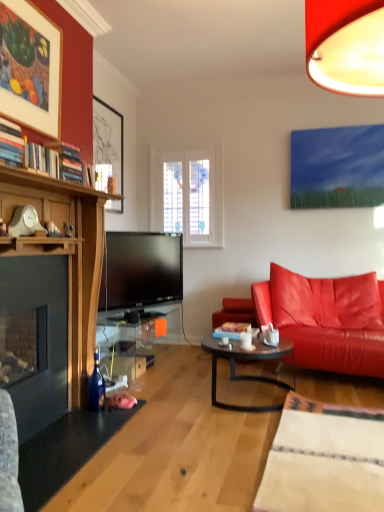
This screenshot has width=384, height=512. Describe the element at coordinates (30, 67) in the screenshot. I see `matte wood picture frame at upper left, the second picture frame positioned from the back` at that location.

What is the approximate height of matte wood picture frame at upper left, the second picture frame positioned from the back?

The height of matte wood picture frame at upper left, the second picture frame positioned from the back, is 27.87 inches.

Where is `leather couch at right`? This screenshot has width=384, height=512. leather couch at right is located at coordinates (326, 319).

Image resolution: width=384 pixels, height=512 pixels. Find the location of `matte wood picture frame at upper left, which is counted as the 1th picture frame, starting from the front`. matte wood picture frame at upper left, which is counted as the 1th picture frame, starting from the front is located at coordinates (30, 67).

Based on the photo, is matte black picture frame at upper left, acting as the 1th picture frame starting from the back, shorter than dark brown glass coffee table at center?

In fact, matte black picture frame at upper left, acting as the 1th picture frame starting from the back, may be taller than dark brown glass coffee table at center.

Is matte black picture frame at upper left, which is the second picture frame from front to back, wider or thinner than dark brown glass coffee table at center?

matte black picture frame at upper left, which is the second picture frame from front to back, is thinner than dark brown glass coffee table at center.

This screenshot has width=384, height=512. In order to click on the 1st picture frame located above the dark brown glass coffee table at center (from a real-world perspective) in this screenshot , I will do `click(108, 140)`.

Is matte black picture frame at upper left, which is the second picture frame from front to back, bigger than dark brown glass coffee table at center?

No, matte black picture frame at upper left, which is the second picture frame from front to back, is not bigger than dark brown glass coffee table at center.

Are transparent glass table at lower center and leather couch at right far apart?

Yes, transparent glass table at lower center and leather couch at right are quite far apart.

How different are the orientations of transparent glass table at lower center and leather couch at right in degrees?

102 degrees.

Is leather couch at right a part of transparent glass table at lower center?

No, leather couch at right is not surrounded by transparent glass table at lower center.

From the image's perspective, which one is positioned higher, matte black picture frame at upper left, which is the second picture frame from front to back, or matte wood picture frame at upper left, which is counted as the 1th picture frame, starting from the front?

From the image's view, matte wood picture frame at upper left, which is counted as the 1th picture frame, starting from the front, is above.

Identify the location of picture frame above the matte black picture frame at upper left, which is the second picture frame from front to back (from a real-world perspective). The width and height of the screenshot is (384, 512). (30, 67).

Is matte black picture frame at upper left, which is the second picture frame from front to back, aimed at matte wood picture frame at upper left, the second picture frame positioned from the back?

No, matte black picture frame at upper left, which is the second picture frame from front to back, is not turned towards matte wood picture frame at upper left, the second picture frame positioned from the back.

Consider the image. Which point is more distant from viewer, (110, 114) or (44, 79)?

The point (110, 114) is farther.

From a real-world perspective, is matte wood picture frame at upper left, which is counted as the 1th picture frame, starting from the front, located higher than dark brown glass coffee table at center?

Yes, from a real-world perspective, matte wood picture frame at upper left, which is counted as the 1th picture frame, starting from the front, is over dark brown glass coffee table at center

Is matte wood picture frame at upper left, the second picture frame positioned from the back, facing towards dark brown glass coffee table at center?

No, matte wood picture frame at upper left, the second picture frame positioned from the back, is not facing towards dark brown glass coffee table at center.

Which object is more forward, matte wood picture frame at upper left, the second picture frame positioned from the back, or dark brown glass coffee table at center?

matte wood picture frame at upper left, the second picture frame positioned from the back, is more forward.

Is matte wood picture frame at upper left, the second picture frame positioned from the back, outside of dark brown glass coffee table at center?

Absolutely, matte wood picture frame at upper left, the second picture frame positioned from the back, is external to dark brown glass coffee table at center.

In the image, is white ceramic mug at center positioned in front of or behind dark brown glass coffee table at center?

In the image, white ceramic mug at center appears behind dark brown glass coffee table at center.

Between white ceramic mug at center and dark brown glass coffee table at center, which one has larger width?

dark brown glass coffee table at center is wider.

Is white ceramic mug at center touching dark brown glass coffee table at center?

No, white ceramic mug at center is not touching dark brown glass coffee table at center.

From a real-world perspective, between white ceramic mug at center and dark brown glass coffee table at center, who is vertically lower?

dark brown glass coffee table at center is physically lower.

Is dark brown glass coffee table at center oriented away from transparent glass table at lower center?

No, transparent glass table at lower center is not at the back of dark brown glass coffee table at center.

Could you measure the distance between dark brown glass coffee table at center and transparent glass table at lower center?

dark brown glass coffee table at center is 1.13 meters away from transparent glass table at lower center.

Is dark brown glass coffee table at center spatially inside transparent glass table at lower center, or outside of it?

dark brown glass coffee table at center is not inside transparent glass table at lower center, it's outside.

From the image's perspective, would you say dark brown glass coffee table at center is positioned over transparent glass table at lower center?

No, from the image's perspective, dark brown glass coffee table at center is not over transparent glass table at lower center.

Could matte black picture frame at upper left, acting as the 1th picture frame starting from the back, be considered to be inside matte wood picture frame at upper left, which is counted as the 1th picture frame, starting from the front?

No, matte black picture frame at upper left, acting as the 1th picture frame starting from the back, is not surrounded by matte wood picture frame at upper left, which is counted as the 1th picture frame, starting from the front.

From a real-world perspective, is matte wood picture frame at upper left, the second picture frame positioned from the back, on top of matte black picture frame at upper left, which is the second picture frame from front to back?

Yes, from a real-world perspective, matte wood picture frame at upper left, the second picture frame positioned from the back, is above matte black picture frame at upper left, which is the second picture frame from front to back.

Between matte wood picture frame at upper left, the second picture frame positioned from the back, and matte black picture frame at upper left, acting as the 1th picture frame starting from the back, which one has smaller size?

Smaller between the two is matte wood picture frame at upper left, the second picture frame positioned from the back.

From the image's perspective, count 1st picture frames upward from the dark brown glass coffee table at center and point to it. Please provide its 2D coordinates.

[(108, 140)]

Where is `table that appears below the leather couch at right (from the image's perspective)`? The width and height of the screenshot is (384, 512). table that appears below the leather couch at right (from the image's perspective) is located at coordinates (135, 340).

Looking at the image, which one is located closer to white ceramic mug at center, leather couch at right or matte black picture frame at upper left, which is the second picture frame from front to back?

leather couch at right lies closer to white ceramic mug at center than the other object.

Based on the photo, which object lies further to the anchor point leather couch at right, transparent glass table at lower center or matte wood picture frame at upper left, the second picture frame positioned from the back?

Among the two, matte wood picture frame at upper left, the second picture frame positioned from the back, is located further to leather couch at right.

In the scene shown: When comparing their distances from matte wood picture frame at upper left, which is counted as the 1th picture frame, starting from the front, does matte black picture frame at upper left, which is the second picture frame from front to back, or white ceramic mug at center seem further?

Based on the image, white ceramic mug at center appears to be further to matte wood picture frame at upper left, which is counted as the 1th picture frame, starting from the front.

Considering their positions, is transparent glass table at lower center positioned closer to matte black picture frame at upper left, which is the second picture frame from front to back, than dark brown glass coffee table at center?

transparent glass table at lower center is positioned closer to the anchor matte black picture frame at upper left, which is the second picture frame from front to back.

Based on their spatial positions, is leather couch at right or matte wood picture frame at upper left, the second picture frame positioned from the back, further from white ceramic mug at center?

matte wood picture frame at upper left, the second picture frame positioned from the back, is further to white ceramic mug at center.

Looking at the image, which one is located closer to matte black picture frame at upper left, acting as the 1th picture frame starting from the back, leather couch at right or white ceramic mug at center?

Among the two, leather couch at right is located nearer to matte black picture frame at upper left, acting as the 1th picture frame starting from the back.

Looking at the image, which one is located further to matte black picture frame at upper left, which is the second picture frame from front to back, white ceramic mug at center or transparent glass table at lower center?

white ceramic mug at center.

Which object lies further to the anchor point white ceramic mug at center, matte black picture frame at upper left, which is the second picture frame from front to back, or dark brown glass coffee table at center?

The object further to white ceramic mug at center is matte black picture frame at upper left, which is the second picture frame from front to back.

Where is `picture frame between matte wood picture frame at upper left, which is counted as the 1th picture frame, starting from the front, and leather couch at right from left to right`? picture frame between matte wood picture frame at upper left, which is counted as the 1th picture frame, starting from the front, and leather couch at right from left to right is located at coordinates (108, 140).

This screenshot has height=512, width=384. I want to click on table between matte black picture frame at upper left, acting as the 1th picture frame starting from the back, and dark brown glass coffee table at center, in the vertical direction, so click(135, 340).

Locate an element on the screen. This screenshot has width=384, height=512. coffee cup between matte wood picture frame at upper left, which is counted as the 1th picture frame, starting from the front, and transparent glass table at lower center in the up-down direction is located at coordinates (246, 341).

Image resolution: width=384 pixels, height=512 pixels. In order to click on coffee table between matte black picture frame at upper left, which is the second picture frame from front to back, and leather couch at right in this screenshot , I will do `click(247, 360)`.